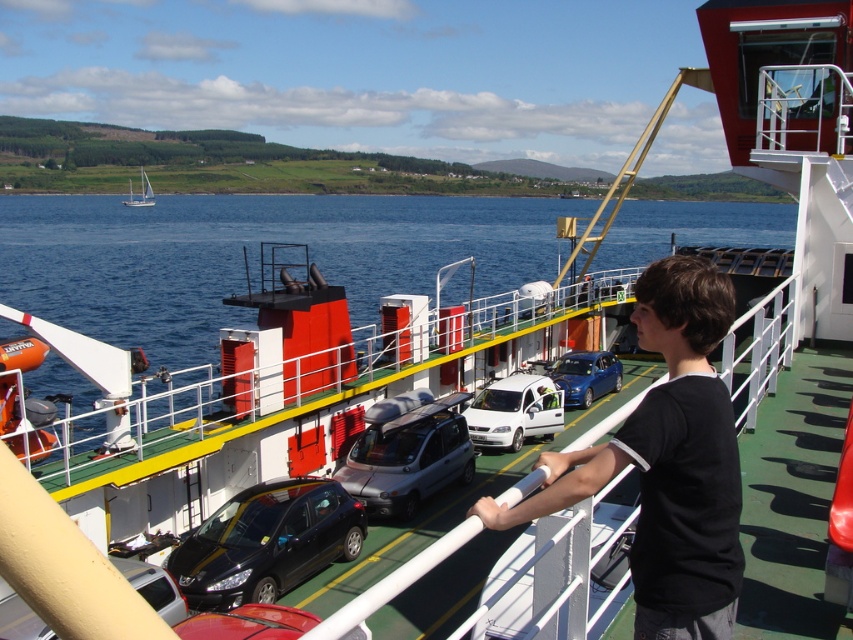
Does silver metallic van at center have a smaller size compared to metallic silver car at center?

Incorrect, silver metallic van at center is not smaller in size than metallic silver car at center.

The height and width of the screenshot is (640, 853). I want to click on silver metallic van at center, so click(408, 452).

Does blue water at center come behind silver metallic van at center?

Yes, it is behind silver metallic van at center.

Is point (360, 317) behind point (373, 502)?

Yes.

At what (x,y) coordinates should I click in order to perform the action: click on blue water at center. Please return your answer as a coordinate pair (x, y). Image resolution: width=853 pixels, height=640 pixels. Looking at the image, I should click on (248, 257).

Is shiny black sedan at center to the left of white sailboat at upper left from the viewer's perspective?

In fact, shiny black sedan at center is to the right of white sailboat at upper left.

Does shiny black sedan at center have a lesser width compared to white sailboat at upper left?

Indeed, shiny black sedan at center has a lesser width compared to white sailboat at upper left.

Between point (253, 548) and point (138, 196), which one is positioned behind?

Positioned behind is point (138, 196).

Find the location of a particular element. This screenshot has height=640, width=853. shiny black sedan at center is located at coordinates (267, 541).